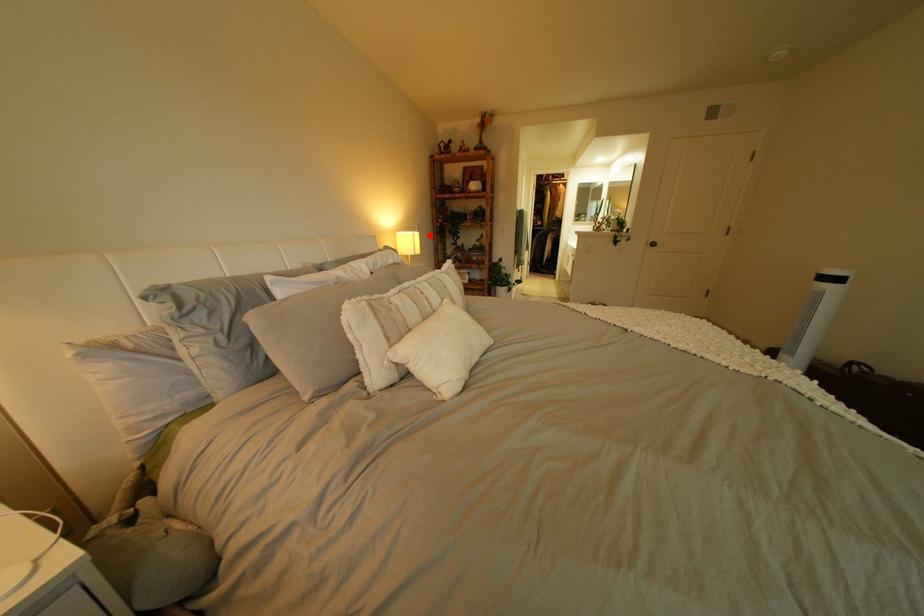
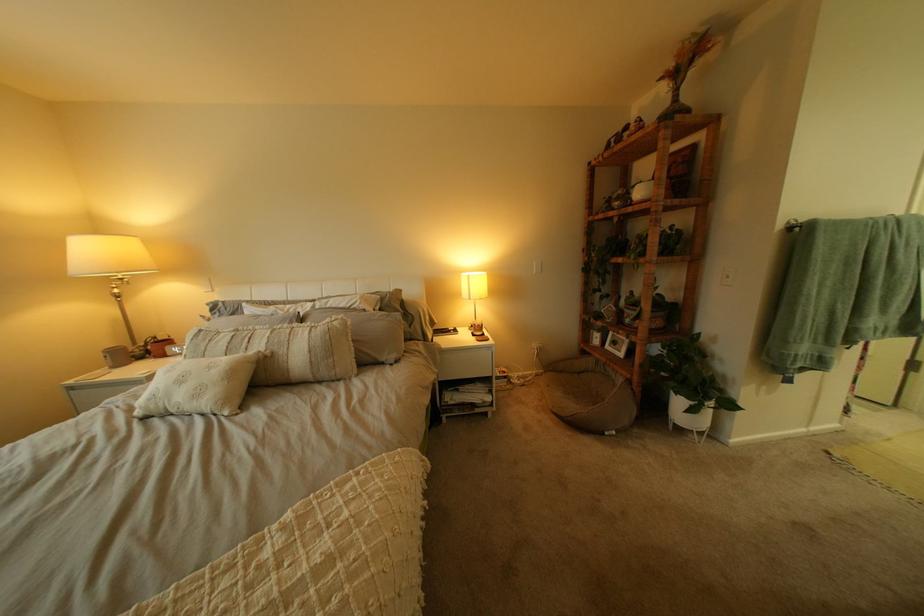
Question: I am providing you with two images of the same scene from different viewpoints. Given a red point in image1, look at the same physical point in image2. Is it:

Choices:
 (A) Closer to the viewpoint
 (B) Farther from the viewpoint

Answer: (B)